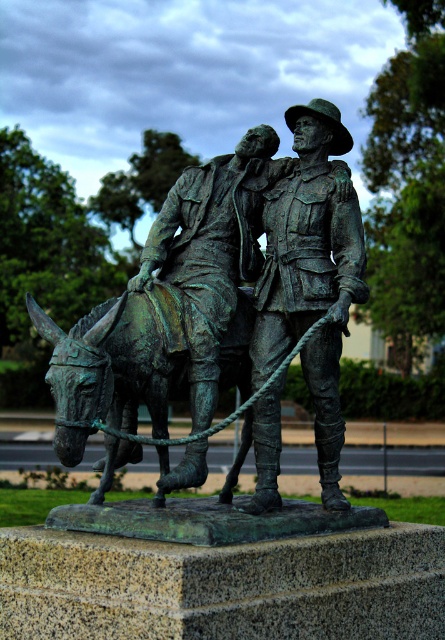
Question: Estimate the real-world distances between objects in this image. Which object is farther from the bronze statue at center?

Choices:
 (A) green patina bronze statue at center
 (B) green patina horse at lower left

Answer: (B)

Question: Can you confirm if green patina bronze statue at center is positioned to the right of bronze statue at center?

Choices:
 (A) yes
 (B) no

Answer: (B)

Question: Among these objects, which one is farthest from the camera?

Choices:
 (A) green patina horse at lower left
 (B) bronze statue at center

Answer: (B)

Question: Does green patina bronze statue at center appear on the left side of green patina horse at lower left?

Choices:
 (A) yes
 (B) no

Answer: (B)

Question: Does bronze statue at center have a larger size compared to green patina horse at lower left?

Choices:
 (A) yes
 (B) no

Answer: (B)

Question: Which object is positioned farthest from the bronze statue at center?

Choices:
 (A) green patina bronze statue at center
 (B) green patina horse at lower left

Answer: (B)